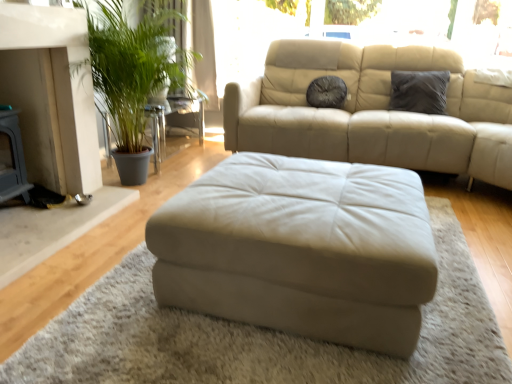
Question: From the image's perspective, does green leafy plant at left appear lower than beige leather ottoman at center?

Choices:
 (A) yes
 (B) no

Answer: (B)

Question: Considering the relative sizes of green leafy plant at left and beige leather ottoman at center in the image provided, is green leafy plant at left thinner than beige leather ottoman at center?

Choices:
 (A) yes
 (B) no

Answer: (A)

Question: Is green leafy plant at left to the right of beige leather ottoman at center from the viewer's perspective?

Choices:
 (A) no
 (B) yes

Answer: (A)

Question: Is green leafy plant at left wider than beige leather ottoman at center?

Choices:
 (A) no
 (B) yes

Answer: (A)

Question: Can you confirm if green leafy plant at left is shorter than beige leather ottoman at center?

Choices:
 (A) no
 (B) yes

Answer: (A)

Question: Is beige leather ottoman at center inside the boundaries of green leafy plant at left, or outside?

Choices:
 (A) outside
 (B) inside

Answer: (A)

Question: Is point (x=368, y=170) closer or farther from the camera than point (x=145, y=134)?

Choices:
 (A) farther
 (B) closer

Answer: (B)

Question: From the image's perspective, is beige leather ottoman at center above or below green leafy plant at left?

Choices:
 (A) above
 (B) below

Answer: (B)

Question: In terms of height, does beige leather ottoman at center look taller or shorter compared to green leafy plant at left?

Choices:
 (A) tall
 (B) short

Answer: (B)

Question: Is point (315, 231) closer or farther from the camera than point (333, 87)?

Choices:
 (A) farther
 (B) closer

Answer: (B)

Question: Based on their positions, is beige leather ottoman at center located to the left or right of dark gray textured pillow at center, the 2th pillow when ordered from right to left?

Choices:
 (A) left
 (B) right

Answer: (A)

Question: In terms of height, does beige leather ottoman at center look taller or shorter compared to dark gray textured pillow at center, the 2th pillow when ordered from right to left?

Choices:
 (A) short
 (B) tall

Answer: (B)

Question: Is beige leather ottoman at center in front of or behind dark gray textured pillow at center, the 2th pillow when ordered from right to left, in the image?

Choices:
 (A) front
 (B) behind

Answer: (A)

Question: Considering their positions, is beige leather ottoman at center located in front of or behind beige fabric ottoman at center?

Choices:
 (A) front
 (B) behind

Answer: (B)

Question: From the image's perspective, relative to beige fabric ottoman at center, is beige leather ottoman at center above or below?

Choices:
 (A) below
 (B) above

Answer: (B)